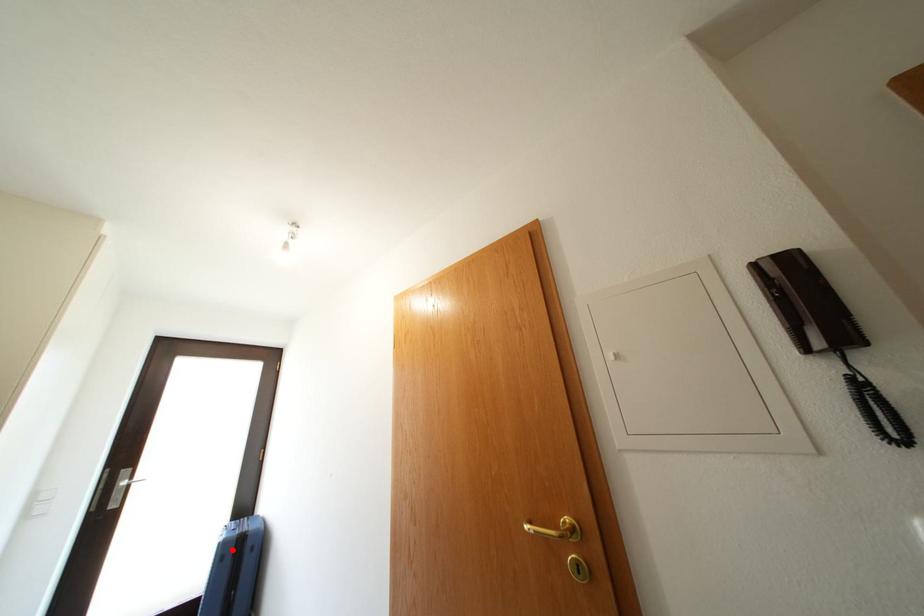
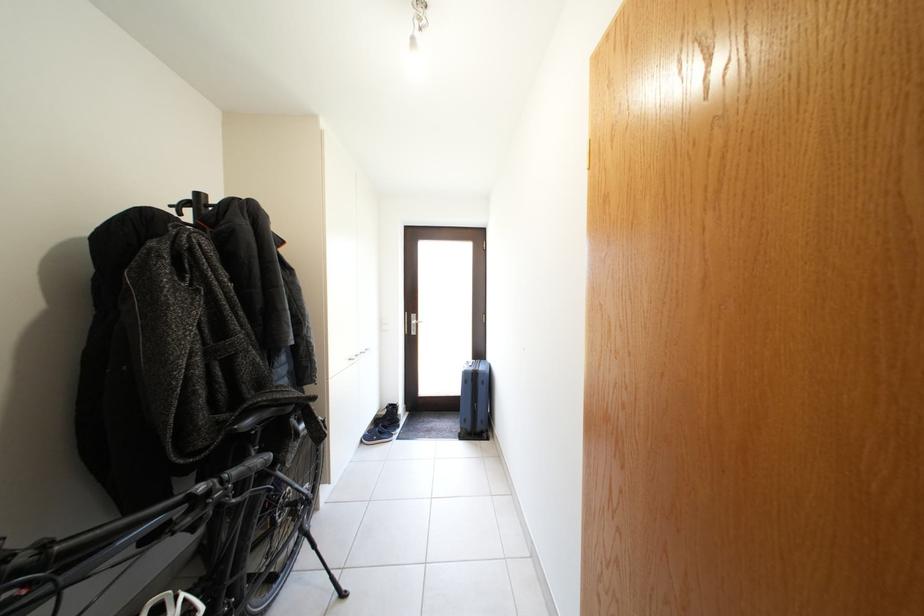
The point at the highlighted location is marked in the first image. Where is the corresponding point in the second image?

(473, 379)